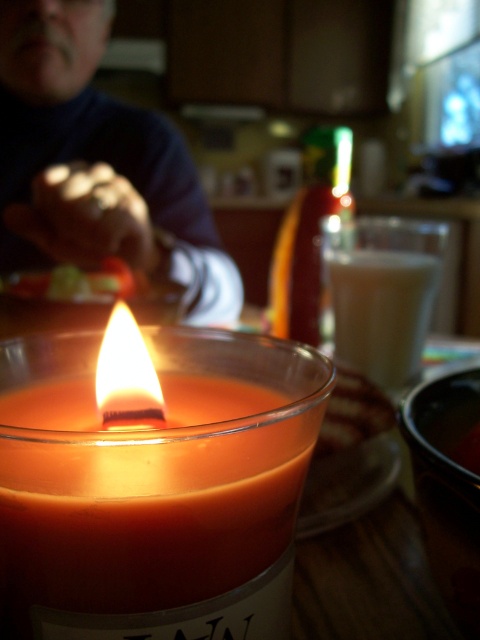
You are looking at the smokey orange wax candle at center and the blue sweater at upper left. Which object is positioned more to the right side of the image?

The smokey orange wax candle at center is positioned more to the right side of the image than the blue sweater at upper left.

You are a photographer trying to capture the translucent glass candle at center without the blue sweater at upper left appearing too large in the background. Based on their sizes, is the sweater likely to be a major distraction in your photo?

The blue sweater at upper left is much taller than the translucent glass candle at center, so it will likely be a major distraction in the photo.